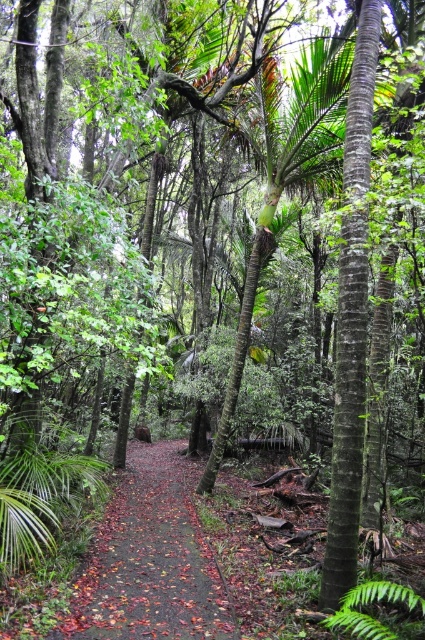
You are a hiker carrying a backpack and need to walk along the brown dirt path at center. Considering your height and the low branches, will you have to duck to avoid hitting your head?

The brown dirt path at center is 13.66 feet away from the viewer. The description does not mention the height of the low branches, so it is unclear if you need to duck.

You are standing at the edge of the tropical forest and see the point marked at coordinates [150,563]. According to the scene description, what is located at that point?

The point at coordinates [150,563] corresponds to the brown dirt path at center.

You are a hiker trying to navigate through the tropical forest. You see the brown dirt path at center and the green leafy fern at center. Which one should you step on to avoid getting your shoes dirty?

The brown dirt path at center is larger in size than the green leafy fern at center, so stepping on the brown dirt path at center would be better to avoid getting your shoes dirty since it offers a wider, more stable surface.